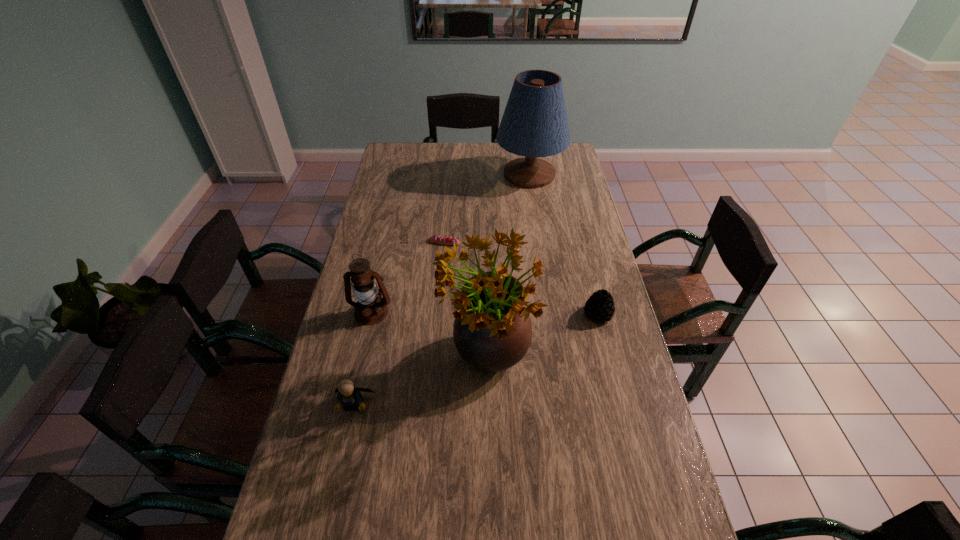
At what (x,y) coordinates should I click in order to perform the action: click on vacant space located 0.200m on the front-facing side of the Lego. Please return your answer as a coordinate pair (x, y). The height and width of the screenshot is (540, 960). Looking at the image, I should click on (334, 496).

Find the location of `free space located 0.100m at the narrow end of the pinecone`. free space located 0.100m at the narrow end of the pinecone is located at coordinates (608, 352).

Find the location of a particular element. This screenshot has height=540, width=960. vacant space located on the front of the shortest object is located at coordinates (437, 321).

The height and width of the screenshot is (540, 960). What are the coordinates of `object present at the far edge` in the screenshot? It's located at (534, 124).

Image resolution: width=960 pixels, height=540 pixels. I want to click on lantern present at the left edge, so click(370, 309).

At what (x,y) coordinates should I click in order to perform the action: click on Lego that is positioned at the left edge. Please return your answer as a coordinate pair (x, y). Looking at the image, I should click on (348, 395).

I want to click on lampshade located at the right edge, so click(534, 124).

What are the coordinates of `pinecone that is positioned at the right edge` in the screenshot? It's located at (600, 306).

Image resolution: width=960 pixels, height=540 pixels. I want to click on object present at the far right corner, so point(534,124).

The height and width of the screenshot is (540, 960). In order to click on vacant area at the far edge of the desktop in this screenshot , I will do `click(482, 148)`.